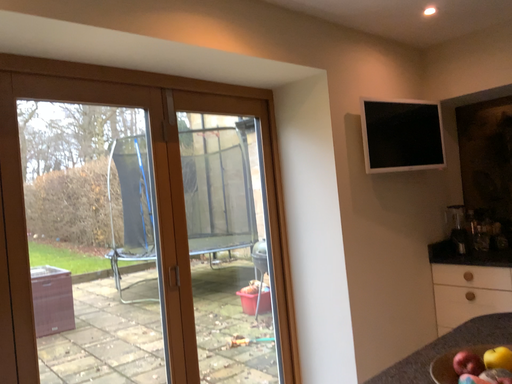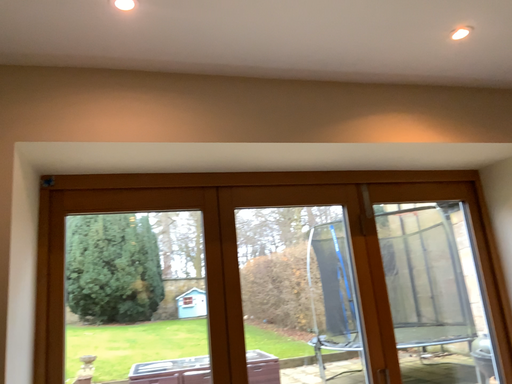
Question: Which way did the camera rotate in the video?

Choices:
 (A) rotated upward
 (B) rotated downward

Answer: (A)